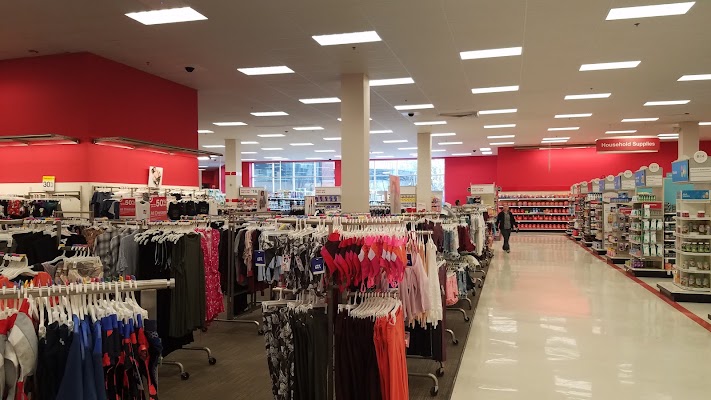
Image resolution: width=711 pixels, height=400 pixels. In order to click on lights in this screenshot , I will do `click(479, 56)`, `click(495, 91)`, `click(365, 30)`, `click(279, 64)`, `click(155, 21)`, `click(620, 11)`.